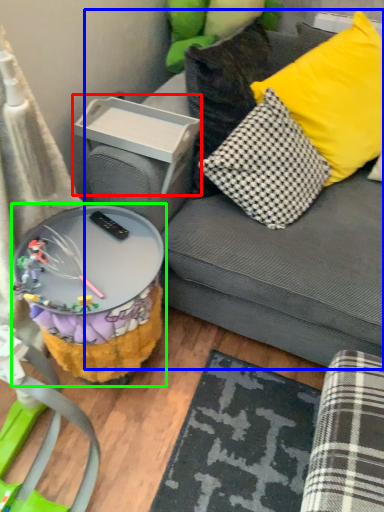
Question: Estimate the real-world distances between objects in this image. Which object is farther from storage box (highlighted by a red box), studio couch (highlighted by a blue box) or table (highlighted by a green box)?

Choices:
 (A) studio couch
 (B) table

Answer: (B)